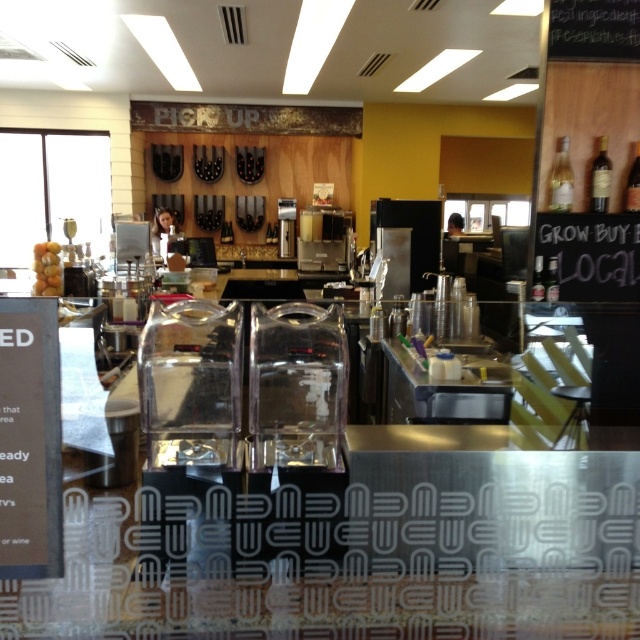
How far apart are black paper menu at lower left and yellow matte grapes at left?

A distance of 9.94 feet exists between black paper menu at lower left and yellow matte grapes at left.

Which of these two, black paper menu at lower left or yellow matte grapes at left, stands shorter?

yellow matte grapes at left

What do you see at coordinates (29, 440) in the screenshot?
I see `black paper menu at lower left` at bounding box center [29, 440].

The width and height of the screenshot is (640, 640). What are the coordinates of `black paper menu at lower left` in the screenshot? It's located at (29, 440).